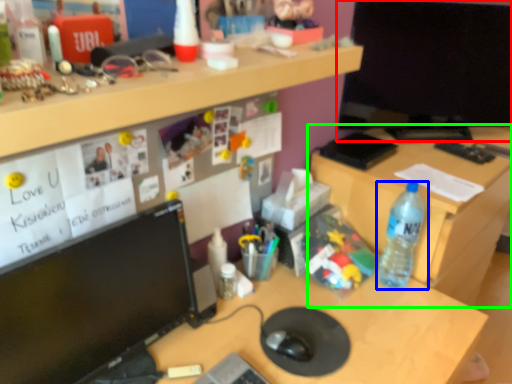
Question: Which is nearer to the computer monitor (highlighted by a red box)? bottle (highlighted by a blue box) or desk (highlighted by a green box).

Choices:
 (A) bottle
 (B) desk

Answer: (B)